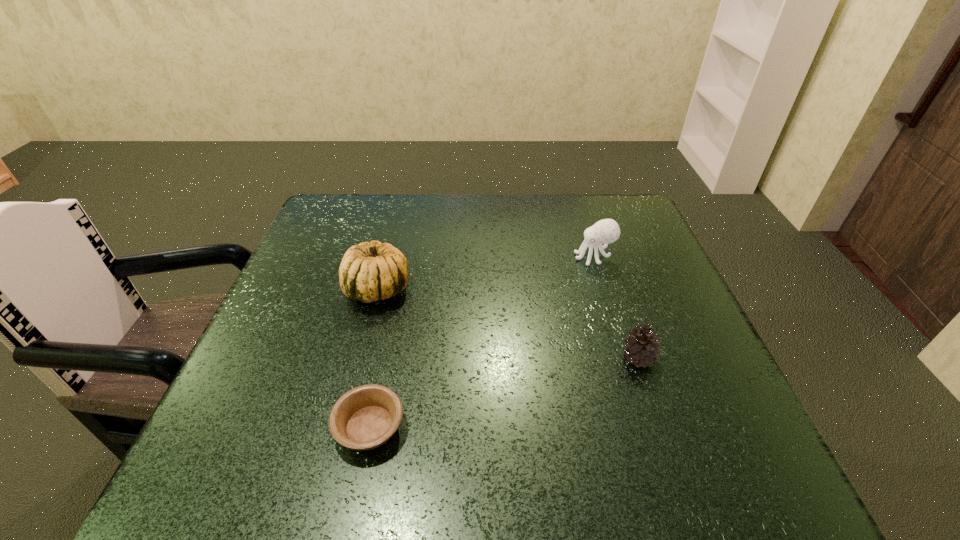
You are a GUI agent. You are given a task and a screenshot of the screen. Output one action in this format:
    pyautogui.click(x=<x>, y=<y>)
    Task: Click on the free space between the octopus and the nearest object
    Image resolution: width=960 pixels, height=540 pixels.
    Given the screenshot: What is the action you would take?
    click(482, 342)

Where is `vacant area between the shortest object and the farthest object`? Image resolution: width=960 pixels, height=540 pixels. vacant area between the shortest object and the farthest object is located at coordinates (482, 342).

Identify which object is the third nearest to the gourd. Please provide its 2D coordinates. Your answer should be formatted as a tuple, i.e. [(x, y)], where the tuple contains the x and y coordinates of a point satisfying the conditions above.

[(643, 348)]

The image size is (960, 540). I want to click on object identified as the second closest to the pinecone, so click(x=365, y=417).

Where is `free space that satisfies the following two spatial constraints: 1. on the front side of the second farthest object; 2. on the right side of the bowl`? free space that satisfies the following two spatial constraints: 1. on the front side of the second farthest object; 2. on the right side of the bowl is located at coordinates (342, 427).

I want to click on free spot that satisfies the following two spatial constraints: 1. on the front-facing side of the farthest object; 2. on the left side of the third farthest object, so click(625, 357).

At what (x,y) coordinates should I click in order to perform the action: click on vacant space that satisfies the following two spatial constraints: 1. on the front-facing side of the farthest object; 2. on the front side of the gourd. Please return your answer as a coordinate pair (x, y). This screenshot has width=960, height=540. Looking at the image, I should click on tap(604, 289).

Where is `vacant space that satisfies the following two spatial constraints: 1. on the back side of the nearest object; 2. on the left side of the second shortest object`? Image resolution: width=960 pixels, height=540 pixels. vacant space that satisfies the following two spatial constraints: 1. on the back side of the nearest object; 2. on the left side of the second shortest object is located at coordinates (384, 357).

Locate an element on the screen. The height and width of the screenshot is (540, 960). vacant region that satisfies the following two spatial constraints: 1. on the front-facing side of the farthest object; 2. on the left side of the pinecone is located at coordinates (625, 357).